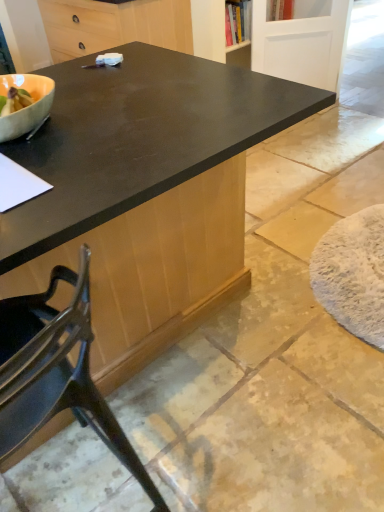
Question: Can you confirm if black matte cabinet at upper center is shorter than metallic black chair at lower left?

Choices:
 (A) yes
 (B) no

Answer: (A)

Question: Is metallic black chair at lower left surrounded by black matte cabinet at upper center?

Choices:
 (A) no
 (B) yes

Answer: (A)

Question: Does black matte cabinet at upper center have a greater width compared to metallic black chair at lower left?

Choices:
 (A) yes
 (B) no

Answer: (A)

Question: Does black matte cabinet at upper center have a smaller size compared to metallic black chair at lower left?

Choices:
 (A) yes
 (B) no

Answer: (B)

Question: From a real-world perspective, does black matte cabinet at upper center stand above metallic black chair at lower left?

Choices:
 (A) no
 (B) yes

Answer: (B)

Question: From the image's perspective, is black matte cabinet at upper center under metallic black chair at lower left?

Choices:
 (A) no
 (B) yes

Answer: (A)

Question: Is metallic black chair at lower left looking in the opposite direction of white painted wood screen door at upper right?

Choices:
 (A) yes
 (B) no

Answer: (B)

Question: Is metallic black chair at lower left shorter than white painted wood screen door at upper right?

Choices:
 (A) yes
 (B) no

Answer: (B)

Question: Are metallic black chair at lower left and white painted wood screen door at upper right located far from each other?

Choices:
 (A) no
 (B) yes

Answer: (B)

Question: Is metallic black chair at lower left next to white painted wood screen door at upper right and touching it?

Choices:
 (A) yes
 (B) no

Answer: (B)

Question: From a real-world perspective, is metallic black chair at lower left on white painted wood screen door at upper right?

Choices:
 (A) yes
 (B) no

Answer: (A)

Question: Is metallic black chair at lower left taller than white painted wood screen door at upper right?

Choices:
 (A) no
 (B) yes

Answer: (B)

Question: Is white painted wood screen door at upper right oriented away from black matte cabinet at upper center?

Choices:
 (A) no
 (B) yes

Answer: (A)